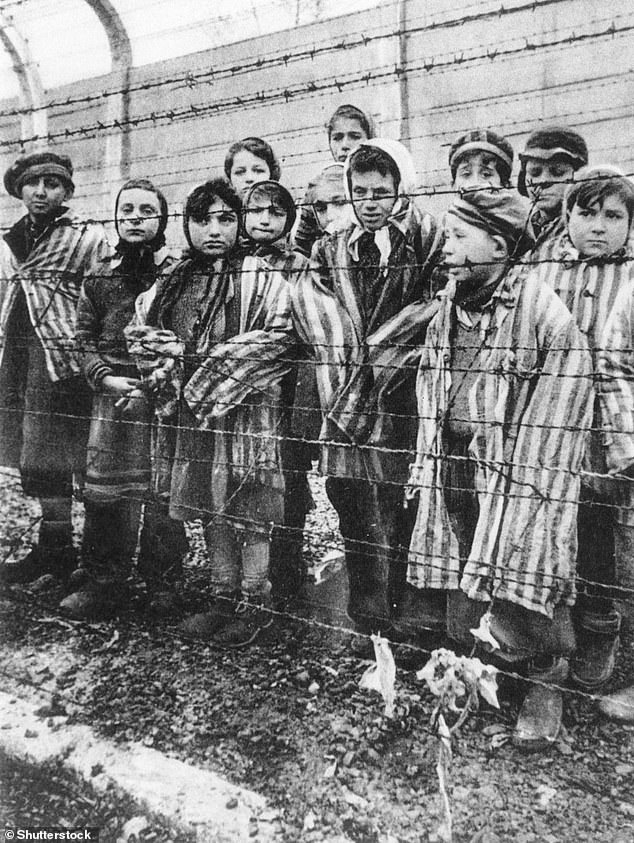
Where is `wall`? This screenshot has width=634, height=843. wall is located at coordinates (512, 67), (153, 133).